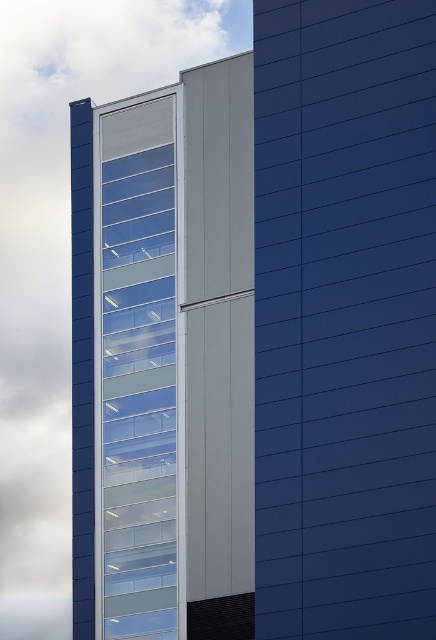
Question: Which object appears farthest from the camera in this image?

Choices:
 (A) transparent glass building at center
 (B) transparent glass windows at upper left

Answer: (A)

Question: Can you confirm if transparent glass building at center is smaller than transparent glass windows at upper left?

Choices:
 (A) no
 (B) yes

Answer: (A)

Question: Which point is farther to the camera?

Choices:
 (A) (64, 380)
 (B) (136, 253)

Answer: (A)

Question: Can you confirm if transparent glass building at center is positioned below transparent glass windows at upper left?

Choices:
 (A) no
 (B) yes

Answer: (A)

Question: Among these points, which one is farthest from the camera?

Choices:
 (A) (155, 452)
 (B) (3, 317)

Answer: (B)

Question: Is transparent glass building at center bigger than transparent glass windows at upper left?

Choices:
 (A) yes
 (B) no

Answer: (A)